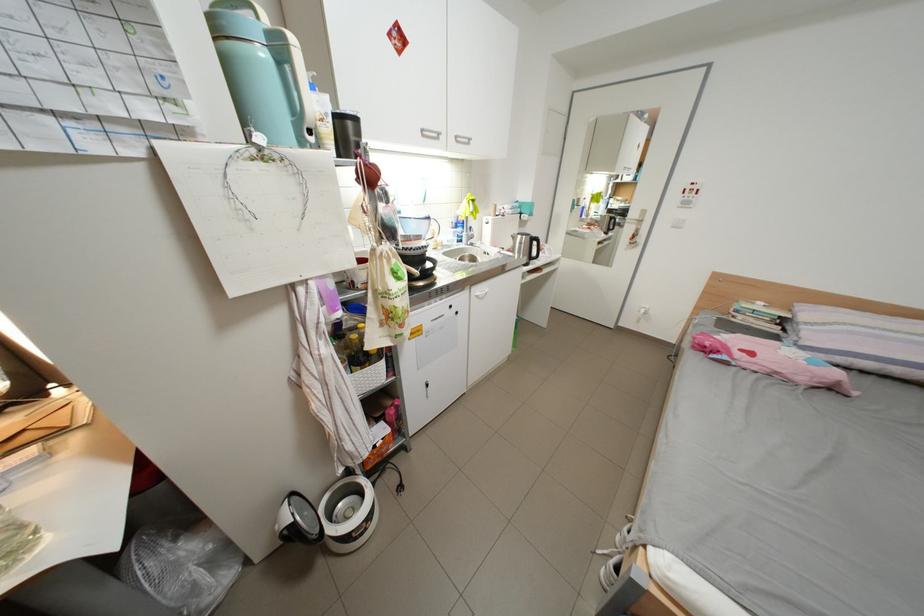
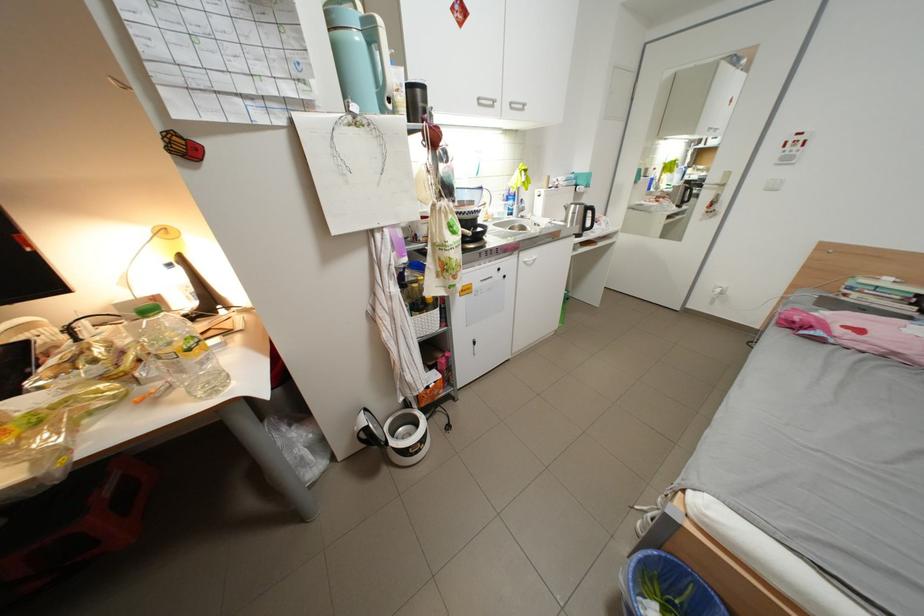
Where in the second image is the point corresponding to the point at 341,531 from the first image?

(404, 444)